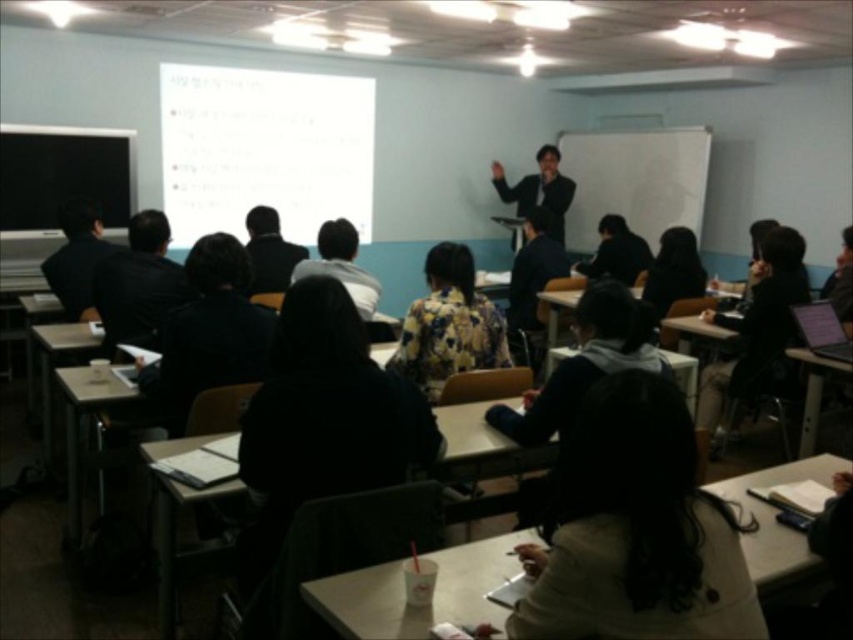
In the scene shown: You are a student trying to decide which jacket to wear to class. You have the black matte jacket at left and the floral fabric jacket at center. Which jacket is more likely to fit into a narrow coat hanger?

The black matte jacket at left is thinner than the floral fabric jacket at center, so it is more likely to fit into a narrow coat hanger.

You are a student sitting in the classroom and need to borrow a pen from the student wearing the floral fabric jacket at center. Since you are currently sitting at the black matte jacket at left, can you directly hand the pen to them without moving from your seat?

The floral fabric jacket at center is behind the black matte jacket at left, so you cannot directly hand the pen to them without moving from your seat because they are seated behind you.